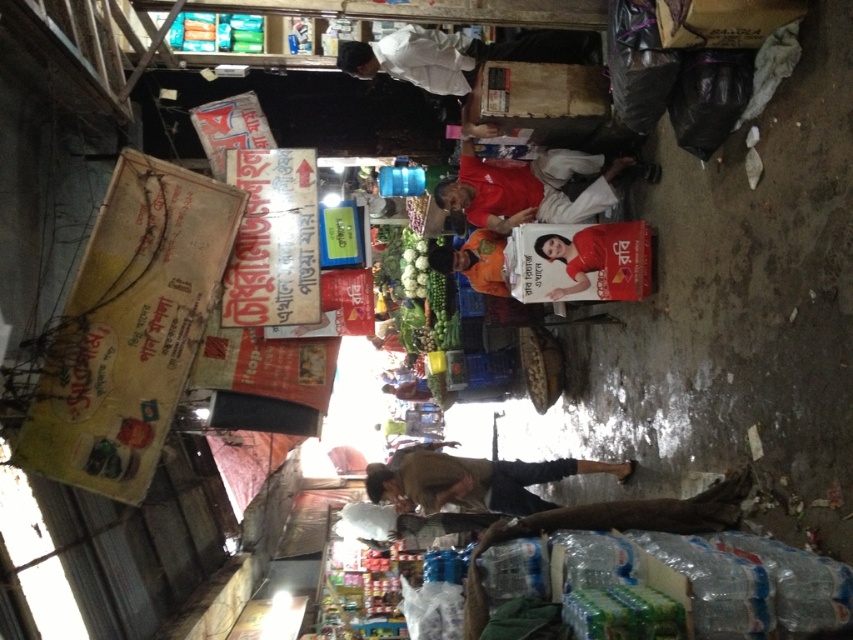
How far apart are brown cotton shirt at center and smooth plastic poster at center?

brown cotton shirt at center is 4.57 feet away from smooth plastic poster at center.

Who is positioned more to the right, brown cotton shirt at center or smooth plastic poster at center?

From the viewer's perspective, smooth plastic poster at center appears more on the right side.

Image resolution: width=853 pixels, height=640 pixels. What do you see at coordinates (473, 481) in the screenshot?
I see `brown cotton shirt at center` at bounding box center [473, 481].

Identify the location of brown cotton shirt at center. This screenshot has width=853, height=640. (473, 481).

Which is in front, point (595, 52) or point (589, 262)?

Point (589, 262) is in front.

From the picture: Between white cloth at upper center and smooth plastic poster at center, which one appears on the right side from the viewer's perspective?

smooth plastic poster at center is more to the right.

Describe the element at coordinates (457, 54) in the screenshot. I see `white cloth at upper center` at that location.

This screenshot has height=640, width=853. I want to click on white cloth at upper center, so click(457, 54).

Which is above, brown cotton shirt at center or white cloth at upper center?

Positioned higher is white cloth at upper center.

Who is shorter, brown cotton shirt at center or white cloth at upper center?

With less height is brown cotton shirt at center.

I want to click on brown cotton shirt at center, so click(473, 481).